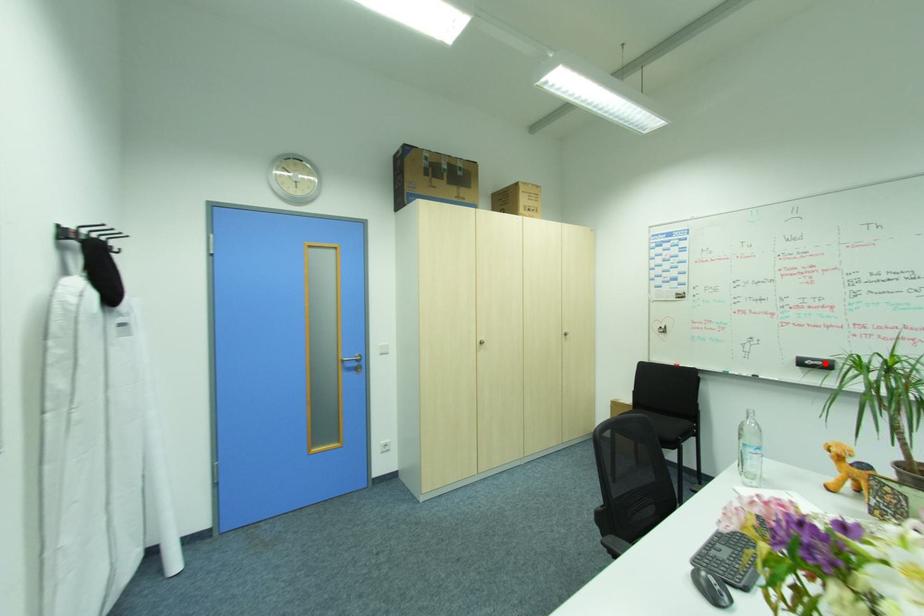
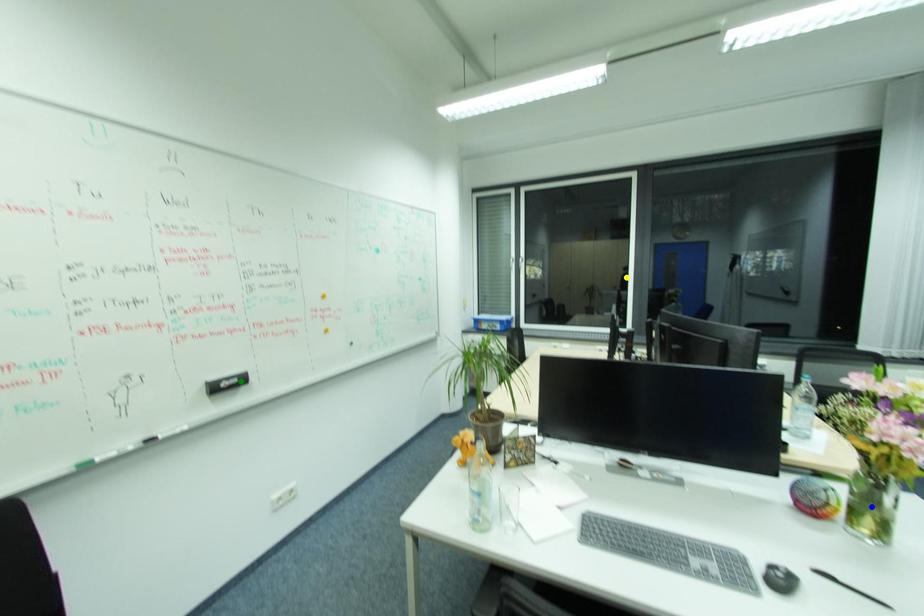
Question: I am providing you with two images of the same scene from different viewpoints. A red point is marked on the first image. You are given multiple points on the second image. In image 2, which mark is for the same physical point as the one in image 1?

Choices:
 (A) yellow point
 (B) blue point
 (C) green point

Answer: (C)